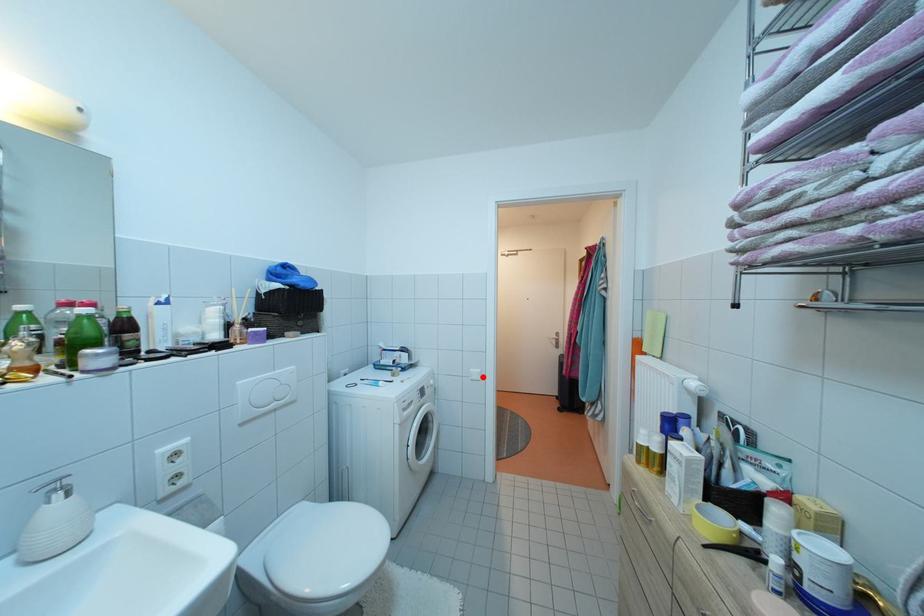
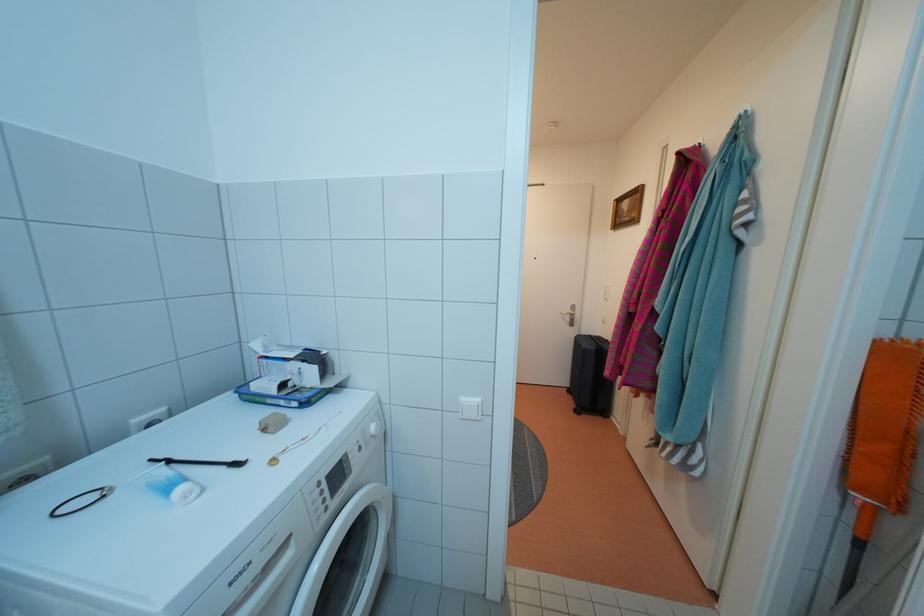
The point at the highlighted location is marked in the first image. Where is the corresponding point in the second image?

(478, 408)